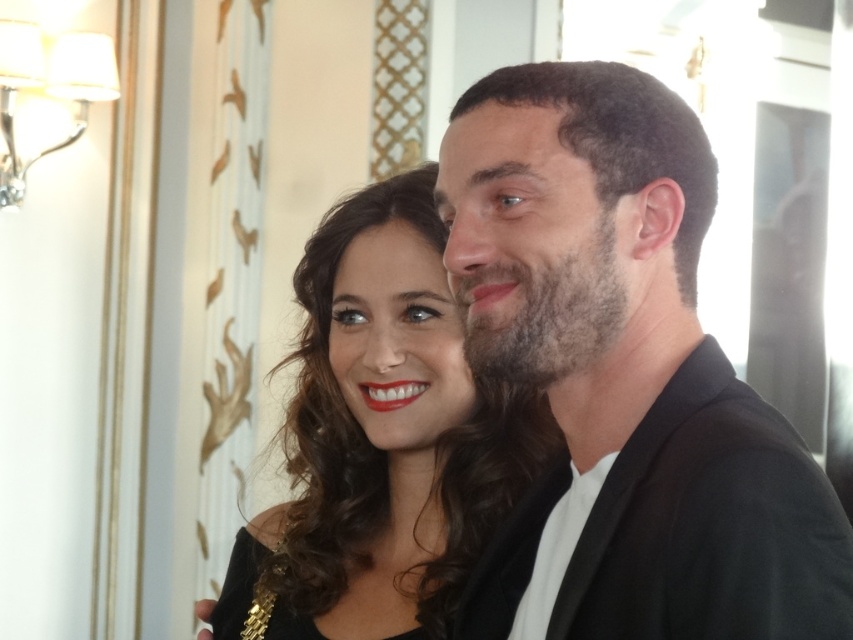
Question: Which of the following is the farthest from the observer?

Choices:
 (A) (389, 326)
 (B) (517, 182)

Answer: (A)

Question: Estimate the real-world distances between objects in this image. Which object is farther from the shiny black dress at center?

Choices:
 (A) black satin dress at center
 (B) smooth black jacket at right
 (C) matte black hair at center

Answer: (B)

Question: Can you confirm if dark brown hair at center is wider than black satin dress at center?

Choices:
 (A) no
 (B) yes

Answer: (A)

Question: Does dark brown hair at center come in front of black satin dress at center?

Choices:
 (A) yes
 (B) no

Answer: (A)

Question: In this image, where is smooth black jacket at right located relative to matte black hair at center?

Choices:
 (A) left
 (B) right

Answer: (B)

Question: Which of the following is the closest to the observer?

Choices:
 (A) (717, 458)
 (B) (381, 316)

Answer: (A)